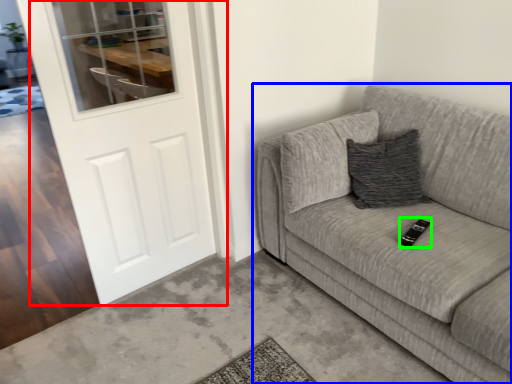
Question: Which is farther away from door (highlighted by a red box)? studio couch (highlighted by a blue box) or remote (highlighted by a green box)?

Choices:
 (A) studio couch
 (B) remote

Answer: (B)